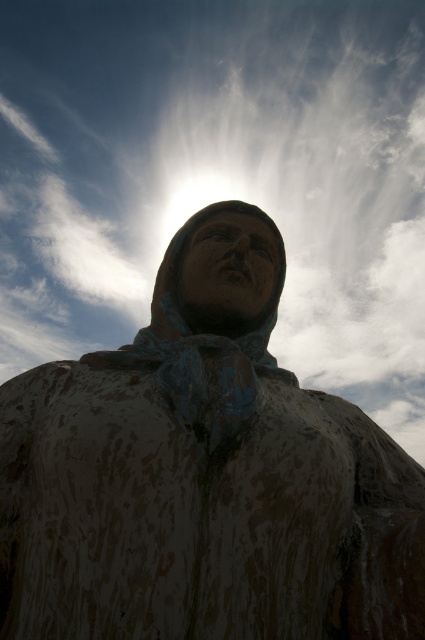
Can you confirm if white fluffy cloud at upper center is positioned above rusty metal statue at center?

Yes, white fluffy cloud at upper center is above rusty metal statue at center.

Is white fluffy cloud at upper center thinner than rusty metal statue at center?

No.

Does point (209, 40) come behind point (101, 403)?

Yes.

Find the location of `white fluffy cloud at upper center`. white fluffy cloud at upper center is located at coordinates (218, 176).